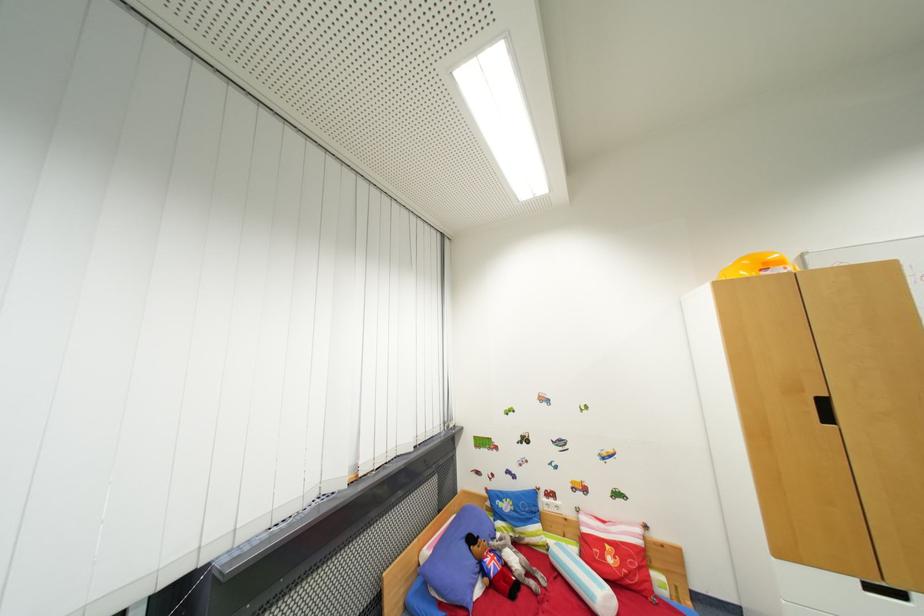
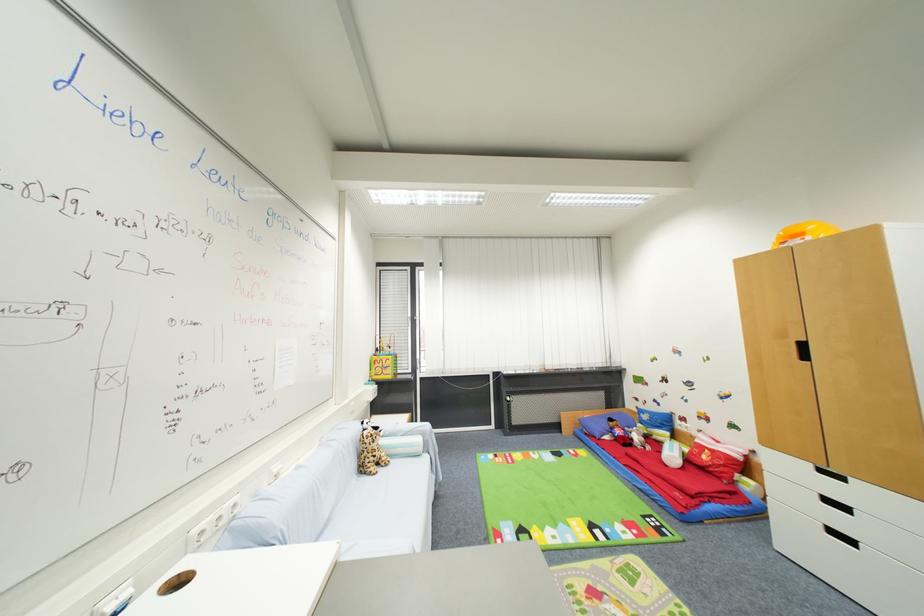
Where in the second image is the point corresponding to point (532, 541) from the first image?

(660, 439)